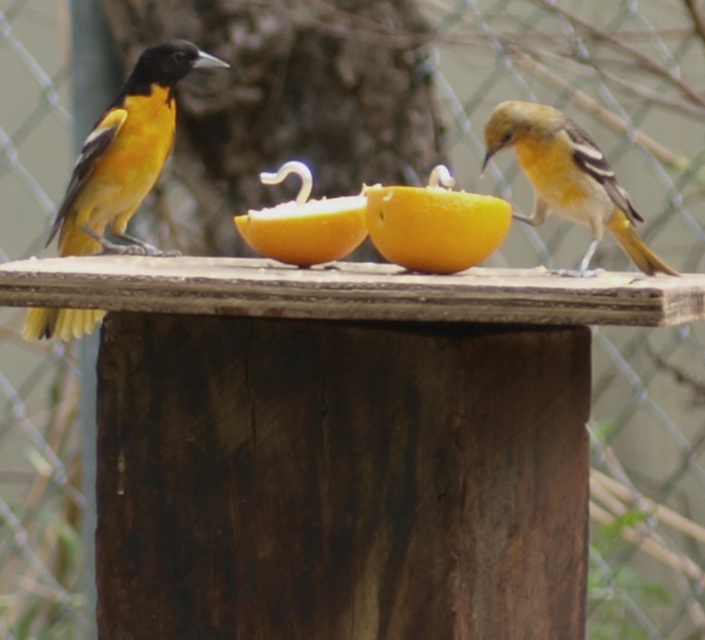
Which is in front, point (565, 170) or point (443, 246)?

Point (443, 246) is in front.

Can you confirm if orange-yellow feathers at right is shorter than yellow matte/orange at center?

Incorrect, orange-yellow feathers at right's height does not fall short of yellow matte/orange at center's.

Between point (608, 166) and point (460, 253), which one is positioned behind?

The point (608, 166) is behind.

This screenshot has height=640, width=705. I want to click on orange-yellow feathers at right, so click(568, 177).

Is point (106, 156) positioned before point (458, 205)?

No.

Which is behind, point (114, 196) or point (458, 257)?

Point (114, 196)

Is point (32, 314) in front of point (435, 204)?

That is False.

At what (x,y) coordinates should I click in order to perform the action: click on golden-yellow feathers at left. Please return your answer as a coordinate pair (x, y). Looking at the image, I should click on (125, 154).

Between point (85, 237) and point (527, 179), which one is positioned in front?

Point (527, 179)

Is point (128, 188) positioned before point (534, 212)?

No.

Identify the location of golden-yellow feathers at left. The image size is (705, 640). (125, 154).